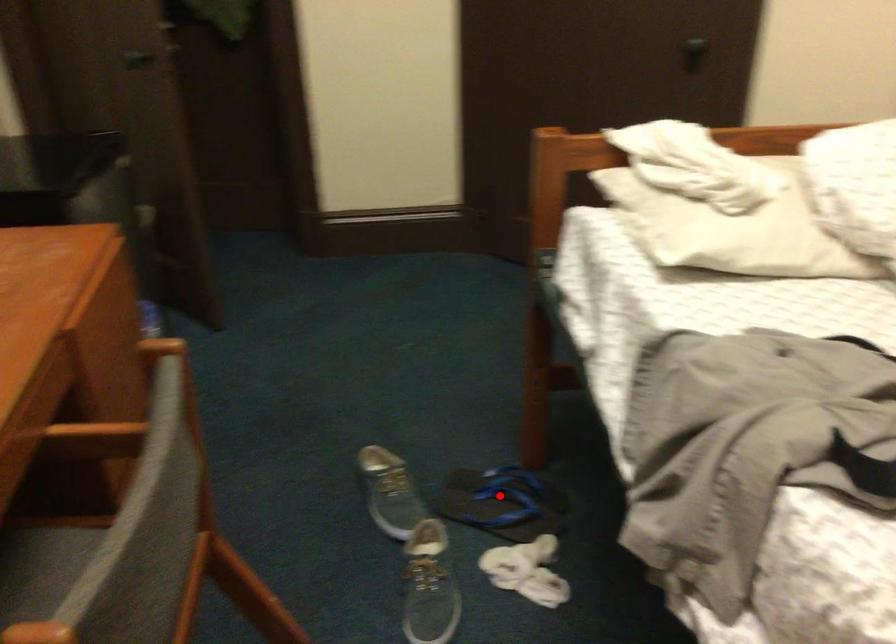
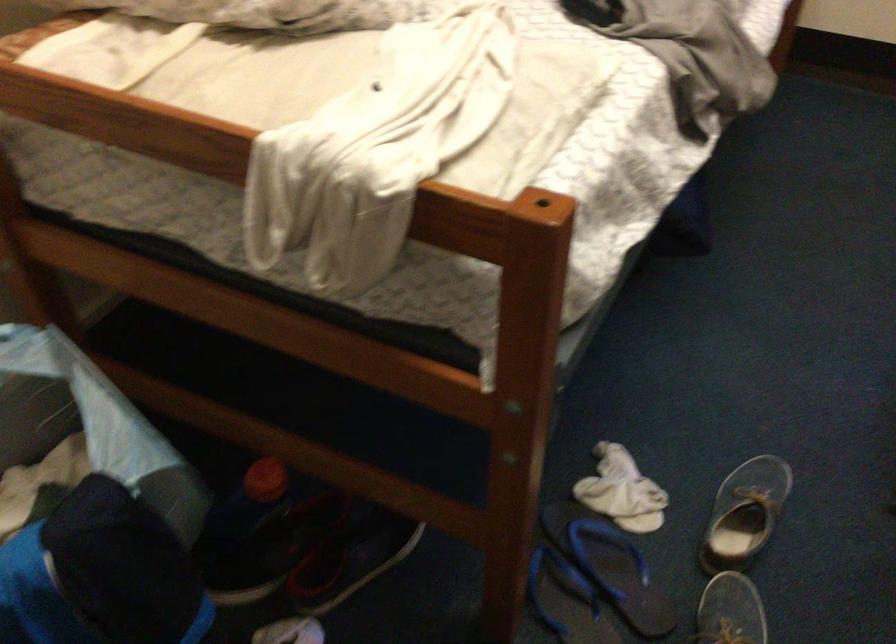
Find the pixel in the second image that matches the highlighted location in the first image.

(566, 600)